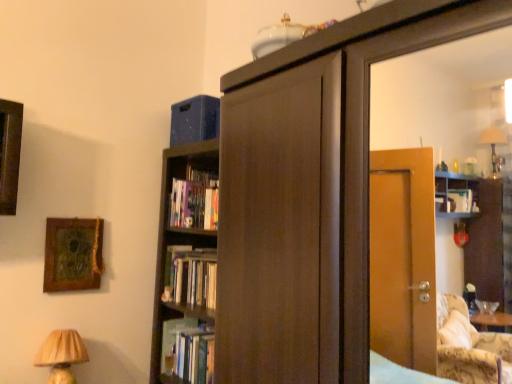
Question: Is there a large distance between hardcover book at center, the second book from the top, and beige pleated lampshade at lower left?

Choices:
 (A) yes
 (B) no

Answer: (B)

Question: From the image's perspective, is hardcover book at center, which appears as the 1th book when ordered from the bottom, above beige pleated lampshade at lower left?

Choices:
 (A) yes
 (B) no

Answer: (B)

Question: Is hardcover book at center, which appears as the 1th book when ordered from the bottom, looking in the opposite direction of beige pleated lampshade at lower left?

Choices:
 (A) yes
 (B) no

Answer: (B)

Question: Is hardcover book at center, the second book from the top, behind beige pleated lampshade at lower left?

Choices:
 (A) yes
 (B) no

Answer: (A)

Question: Does hardcover book at center, the second book from the top, appear on the left side of beige pleated lampshade at lower left?

Choices:
 (A) no
 (B) yes

Answer: (A)

Question: Is hardcover book at center, the second book from the top, positioned in front of beige pleated lampshade at lower left?

Choices:
 (A) no
 (B) yes

Answer: (A)

Question: Is hardcover book at center, acting as the 2th book starting from the bottom, closer to camera compared to wooden textured picture frame at upper left?

Choices:
 (A) no
 (B) yes

Answer: (A)

Question: Could wooden textured picture frame at upper left be considered to be inside hardcover book at center, acting as the 2th book starting from the bottom?

Choices:
 (A) no
 (B) yes

Answer: (A)

Question: Considering the relative sizes of hardcover book at center, acting as the 2th book starting from the bottom, and wooden textured picture frame at upper left in the image provided, is hardcover book at center, acting as the 2th book starting from the bottom, bigger than wooden textured picture frame at upper left?

Choices:
 (A) yes
 (B) no

Answer: (A)

Question: Would you consider hardcover book at center, which is the 1th book in top-to-bottom order, to be distant from wooden textured picture frame at upper left?

Choices:
 (A) yes
 (B) no

Answer: (B)

Question: Considering the relative sizes of hardcover book at center, which is the 1th book in top-to-bottom order, and wooden textured picture frame at upper left in the image provided, is hardcover book at center, which is the 1th book in top-to-bottom order, wider than wooden textured picture frame at upper left?

Choices:
 (A) yes
 (B) no

Answer: (A)

Question: Considering the relative positions of hardcover book at center, acting as the 2th book starting from the bottom, and wooden textured picture frame at upper left in the image provided, is hardcover book at center, acting as the 2th book starting from the bottom, to the left of wooden textured picture frame at upper left from the viewer's perspective?

Choices:
 (A) yes
 (B) no

Answer: (B)

Question: Is hardcover book at center, the second book from the top, positioned before wooden textured picture frame at upper left?

Choices:
 (A) no
 (B) yes

Answer: (A)